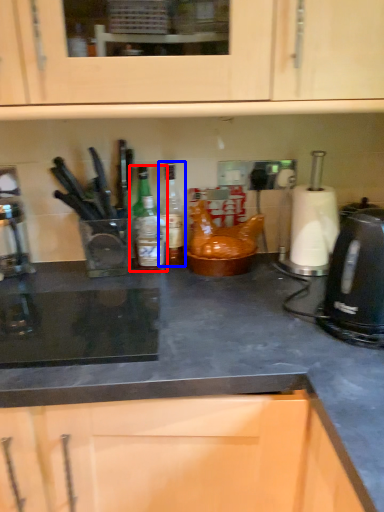
Question: Which of the following is the farthest to the observer, kitchen appliance (highlighted by a red box) or bottle (highlighted by a blue box)?

Choices:
 (A) kitchen appliance
 (B) bottle

Answer: (B)